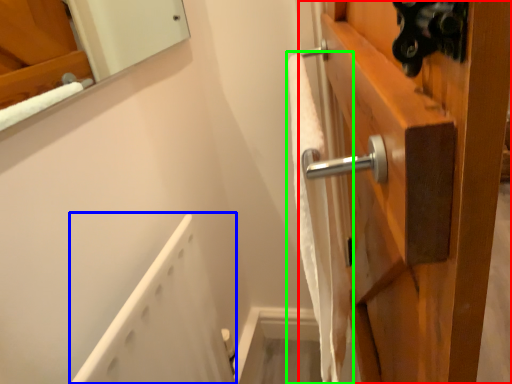
Question: Estimate the real-world distances between objects in this image. Which object is farther from door (highlighted by a red box), bath (highlighted by a blue box) or bath towel (highlighted by a green box)?

Choices:
 (A) bath
 (B) bath towel

Answer: (A)